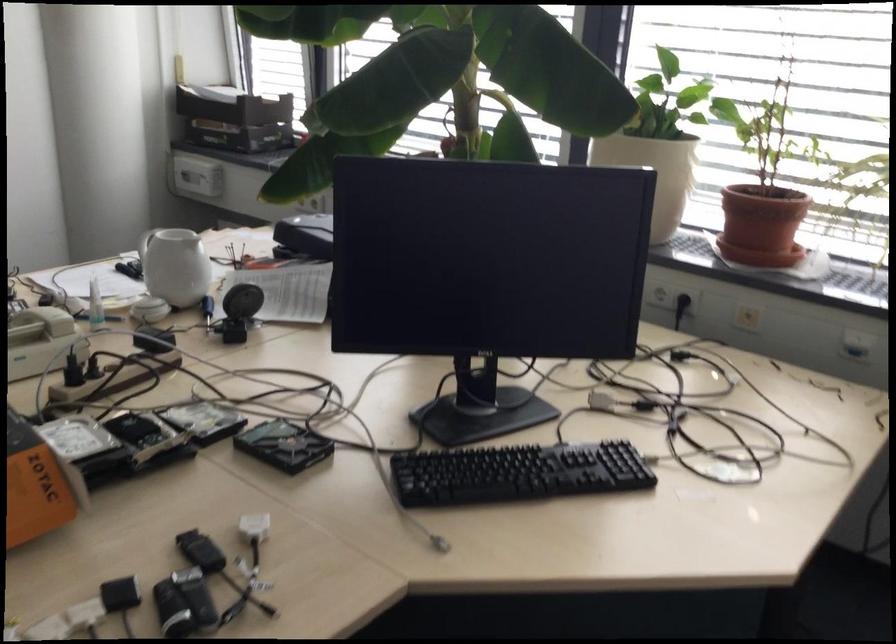
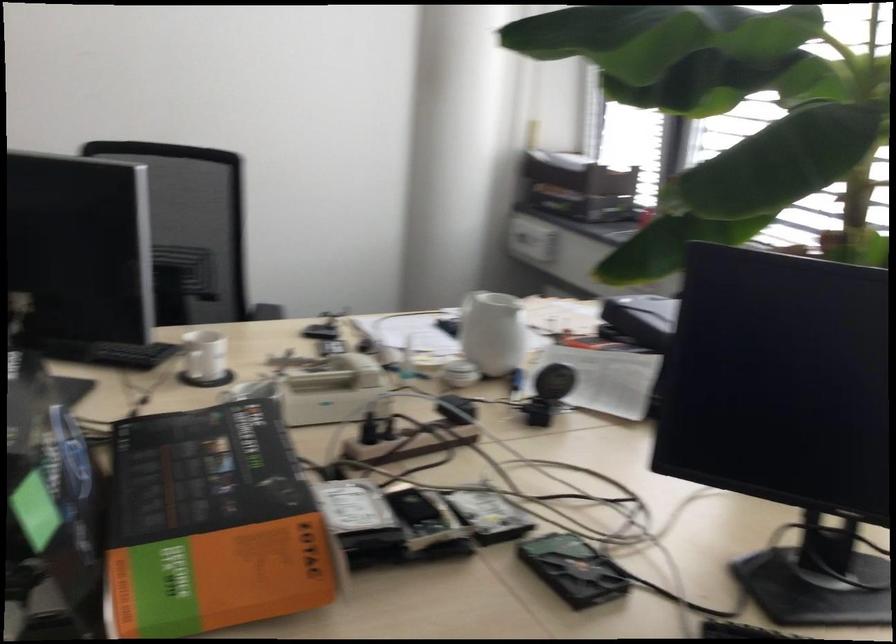
Question: The camera is either moving clockwise (left) or counter-clockwise (right) around the object. The first image is from the beginning of the video and the second image is from the end. Is the camera moving left or right when shooting the video?

Choices:
 (A) Left
 (B) Right

Answer: (B)